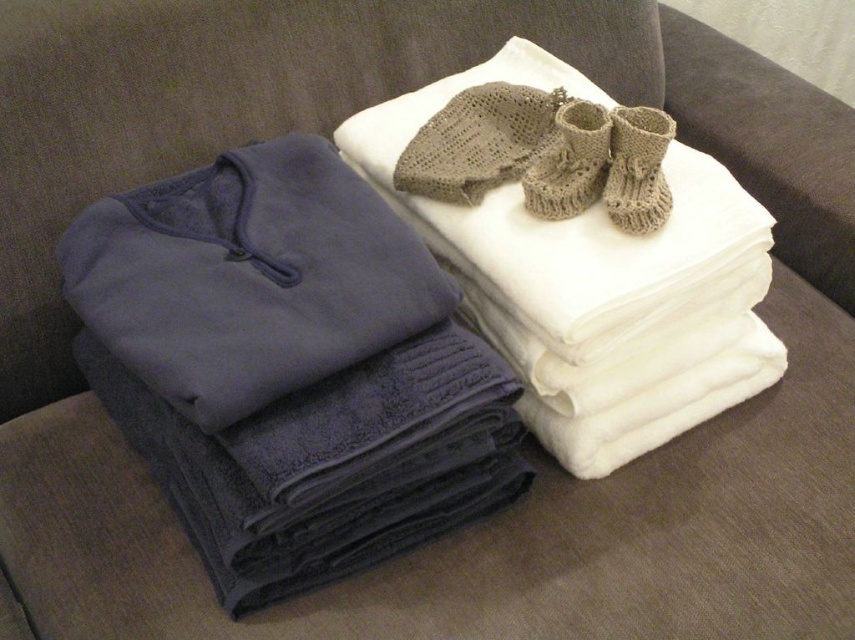
Question: Which object is positioned farthest from the knitted beige booties at upper center?

Choices:
 (A) knitted beige booties at upper right
 (B) navy fleece sweater at left

Answer: (B)

Question: Which point is farther from the camera taking this photo?

Choices:
 (A) (540, 172)
 (B) (641, 211)
 (C) (169, 332)

Answer: (A)

Question: Does navy fleece sweater at left appear over knitted beige booties at upper center?

Choices:
 (A) yes
 (B) no

Answer: (B)

Question: Which point is closer to the camera?

Choices:
 (A) (550, 179)
 (B) (656, 140)
 (C) (340, 292)

Answer: (C)

Question: Is navy fleece sweater at left bigger than knitted beige booties at upper right?

Choices:
 (A) yes
 (B) no

Answer: (A)

Question: In this image, where is navy fleece sweater at left located relative to knitted beige booties at upper center?

Choices:
 (A) below
 (B) above

Answer: (A)